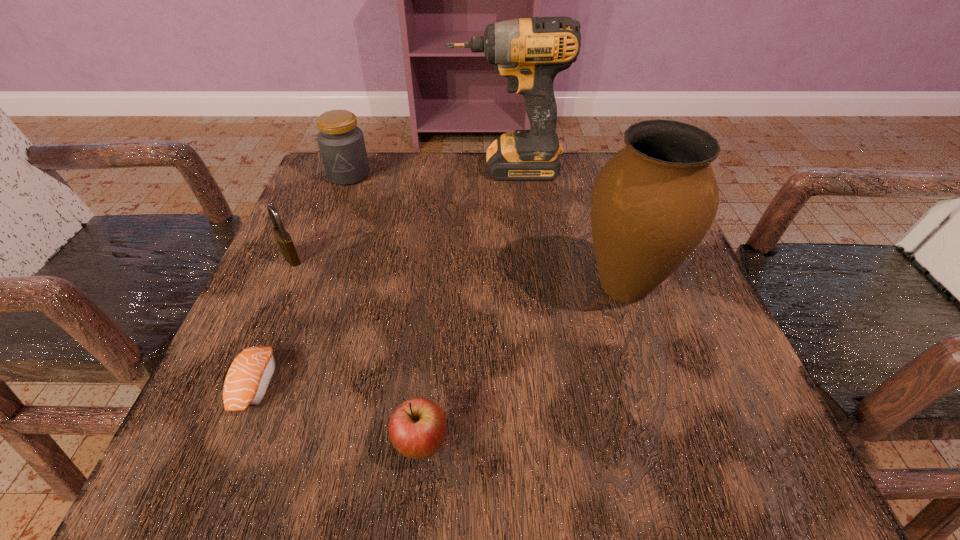
Where is `drill`? drill is located at coordinates (529, 52).

Where is `the fifth shortest object`? the fifth shortest object is located at coordinates (653, 202).

This screenshot has height=540, width=960. I want to click on the fourth shortest object, so click(341, 143).

Identify the location of the third shortest object. (284, 240).

Where is `the nearest object`? This screenshot has height=540, width=960. the nearest object is located at coordinates coord(417,428).

The width and height of the screenshot is (960, 540). Find the location of `apple`. apple is located at coordinates (417, 428).

The image size is (960, 540). What are the coordinates of `sushi` in the screenshot? It's located at (248, 378).

Identify the location of the shortest object. (248, 378).

You are a GUI agent. You are given a task and a screenshot of the screen. Output one action in this format:
    pyautogui.click(x=<x>, y=<y>)
    Task: Click on the free point located 0.260m with the drill bit of the drill facing forward
    The width and height of the screenshot is (960, 540).
    Given the screenshot: What is the action you would take?
    pyautogui.click(x=340, y=168)

Where is `vacant space located with the drill bit of the drill facing forward`? Image resolution: width=960 pixels, height=540 pixels. vacant space located with the drill bit of the drill facing forward is located at coordinates (352, 168).